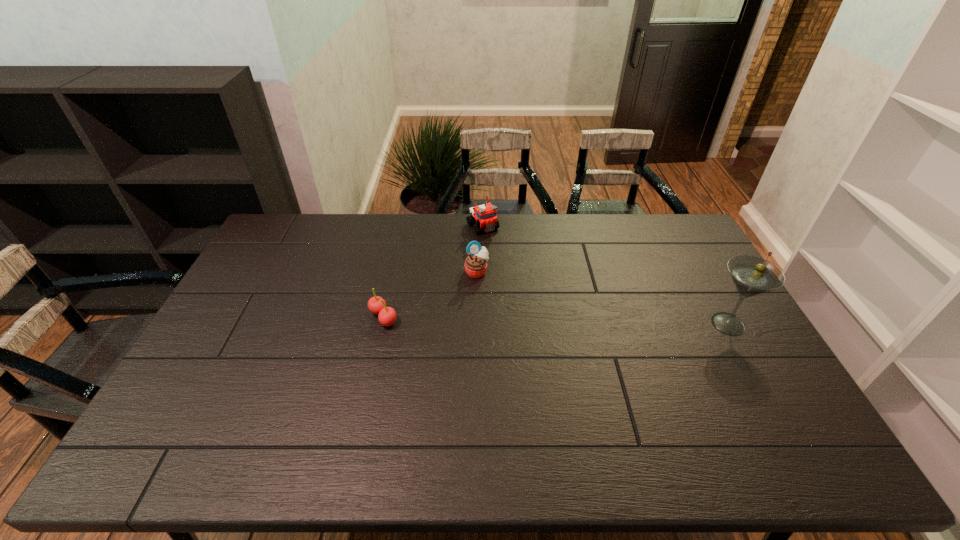
Locate an element on the screen. object that is the third nearest to the farthest object is located at coordinates (751, 275).

Choose which object is the third nearest neighbor to the third nearest object. Please provide its 2D coordinates. Your answer should be formatted as a tuple, i.e. [(x, y)], where the tuple contains the x and y coordinates of a point satisfying the conditions above.

[(751, 275)]

This screenshot has height=540, width=960. In order to click on blank space that satisfies the following two spatial constraints: 1. on the back side of the leftmost object; 2. on the left side of the muffin in this screenshot , I will do `click(394, 271)`.

Where is `blank space that satisfies the following two spatial constraints: 1. on the back side of the muffin; 2. on the left side of the farthest object`? This screenshot has width=960, height=540. blank space that satisfies the following two spatial constraints: 1. on the back side of the muffin; 2. on the left side of the farthest object is located at coordinates (477, 227).